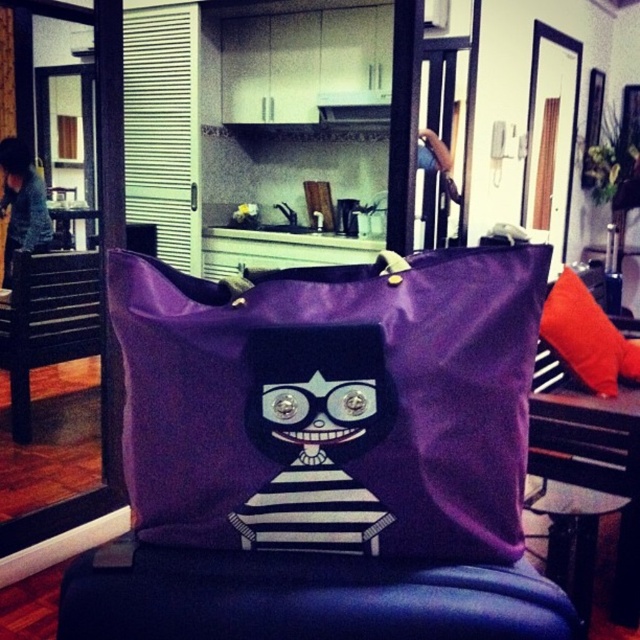
Who is positioned more to the left, purple fabric tote at center or orange fabric pillow at right?

purple fabric tote at center

Can you confirm if purple fabric tote at center is thinner than orange fabric pillow at right?

Correct, purple fabric tote at center's width is less than orange fabric pillow at right's.

I want to click on purple fabric tote at center, so click(332, 404).

Which is below, purple fabric tote at center or purple fabric stool at center?

purple fabric stool at center is lower down.

In the scene shown: Is purple fabric tote at center positioned in front of purple fabric stool at center?

No.

Is point (349, 342) farther from viewer compared to point (154, 609)?

That is False.

Where is `purple fabric tote at center`? purple fabric tote at center is located at coordinates (332, 404).

Image resolution: width=640 pixels, height=640 pixels. What are the coordinates of `purple fabric tote at center` in the screenshot? It's located at (332, 404).

Between point (339, 403) and point (20, 205), which one is positioned in front?

Point (339, 403) is more forward.

You are a GUI agent. You are given a task and a screenshot of the screen. Output one action in this format:
    pyautogui.click(x=<x>, y=<y>)
    Task: Click on the purple fabric tote at center
    
    Given the screenshot: What is the action you would take?
    pyautogui.click(x=332, y=404)